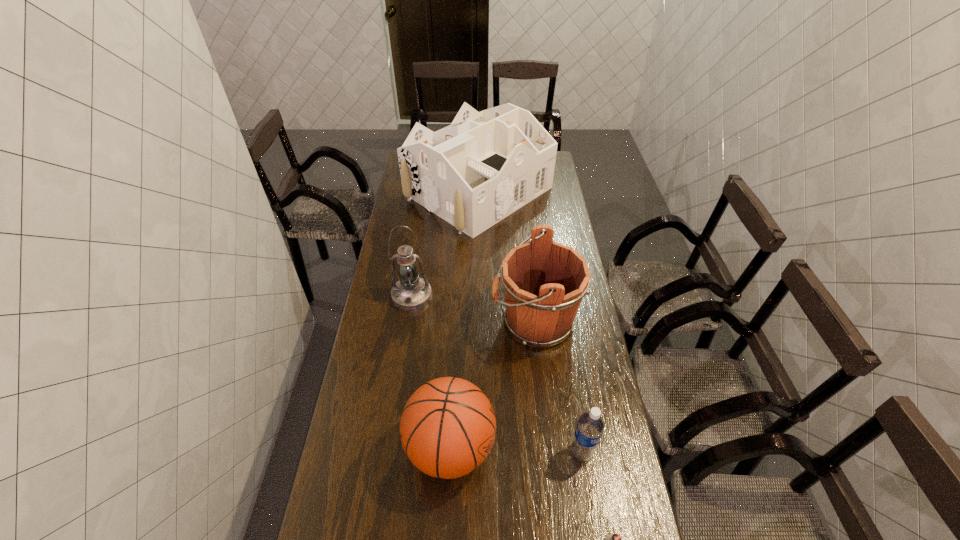
Where is `dollhouse`? dollhouse is located at coordinates click(x=475, y=172).

At what (x,y) coordinates should I click in order to perform the action: click on oil lamp. Please return your answer as a coordinate pair (x, y). Looking at the image, I should click on (411, 293).

This screenshot has height=540, width=960. In order to click on bucket in this screenshot , I will do `click(544, 281)`.

Where is `basketball`? This screenshot has width=960, height=540. basketball is located at coordinates (447, 429).

Where is `water bottle`? The width and height of the screenshot is (960, 540). water bottle is located at coordinates (590, 426).

At what (x,y) coordinates should I click in order to perform the action: click on vacant region located on the front of the dollhouse. Please return your answer as a coordinate pair (x, y). This screenshot has height=540, width=960. Looking at the image, I should click on (478, 253).

Locate an element on the screen. vacant space located on the back of the oil lamp is located at coordinates (417, 264).

Locate an element on the screen. The width and height of the screenshot is (960, 540). free region located with the handle on the side of the bucket is located at coordinates (413, 322).

Where is `vacant space located with the handle on the side of the bucket`? vacant space located with the handle on the side of the bucket is located at coordinates (463, 322).

The image size is (960, 540). In order to click on free space located with the handle on the side of the bucket in this screenshot , I will do `click(410, 322)`.